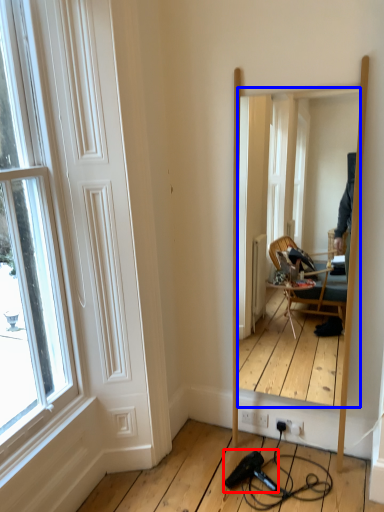
Question: Which of the following is the farthest to the observer, hair drier (highlighted by a red box) or mirror (highlighted by a blue box)?

Choices:
 (A) hair drier
 (B) mirror

Answer: (A)